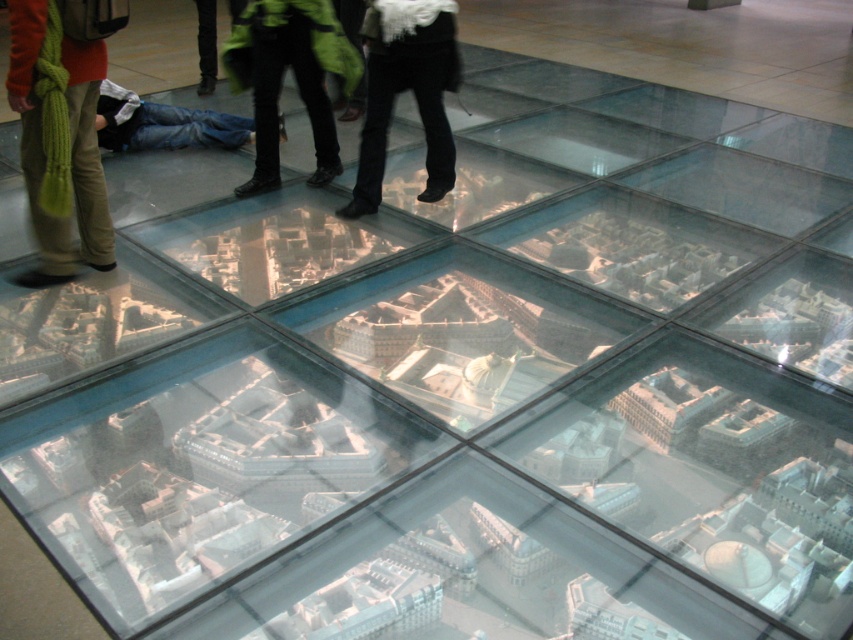
You are standing on the glass floor installation and want to pick up the knitted green scarf at left and the denim jeans at lower left. Which object is closer to you?

Answer: The knitted green scarf at left is closer to you because it is in front of the denim jeans at lower left.

Consider the image. You are standing on the glass floor installation and see the knitted green scarf at left and the green matte jacket at upper center. Which item is located more to the left side?

The knitted green scarf at left is positioned on the left side of the green matte jacket at upper center, so it is more to the left.